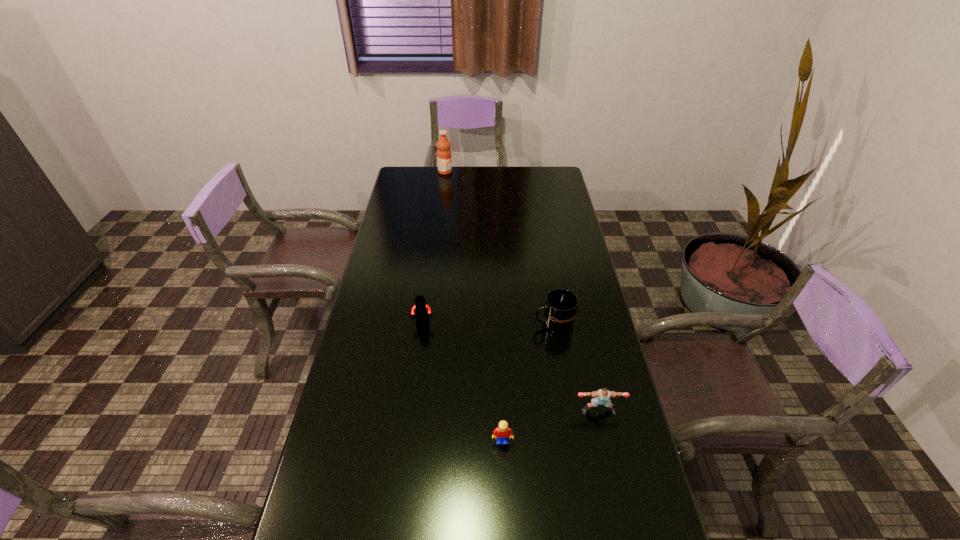
You are a GUI agent. You are given a task and a screenshot of the screen. Output one action in this format:
    pyautogui.click(x=<x>, y=<y>)
    Task: Click on the fruit juice
    Image resolution: width=960 pixels, height=540 pixels.
    Given the screenshot: What is the action you would take?
    pyautogui.click(x=444, y=160)

Identify the location of the tallest object. (444, 160).

This screenshot has height=540, width=960. Find the location of `the farther Lego`. the farther Lego is located at coordinates (421, 311).

Locate an element on the screen. the left Lego is located at coordinates (421, 311).

I want to click on mug, so click(560, 308).

Identify the location of the fourth farthest object. (602, 396).

This screenshot has width=960, height=540. I want to click on the nearest object, so click(x=501, y=433).

Find the location of a particular element. This screenshot has width=960, height=540. the shorter Lego is located at coordinates (501, 433).

In order to click on vacant space situated on the front label of the farthest object in this screenshot , I will do `click(468, 172)`.

Where is `free region located on the front-facing side of the taller Lego`? free region located on the front-facing side of the taller Lego is located at coordinates (420, 346).